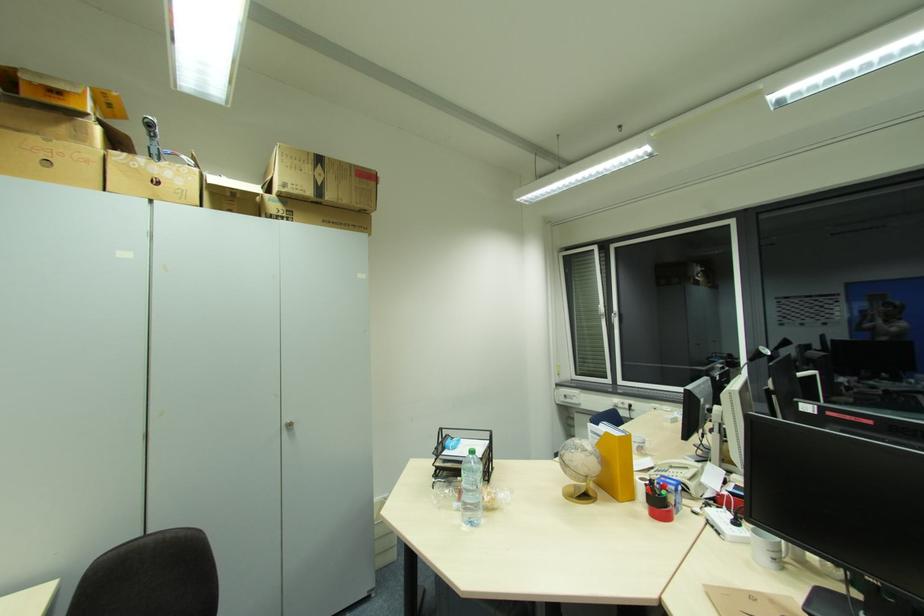
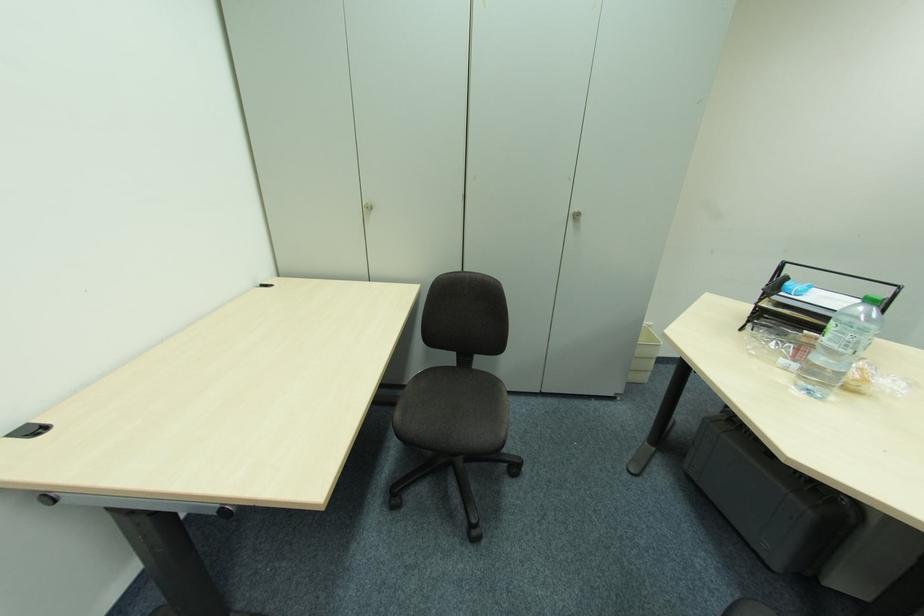
Based on the continuous images, in which direction is the camera rotating?

The camera rotated toward left-down.